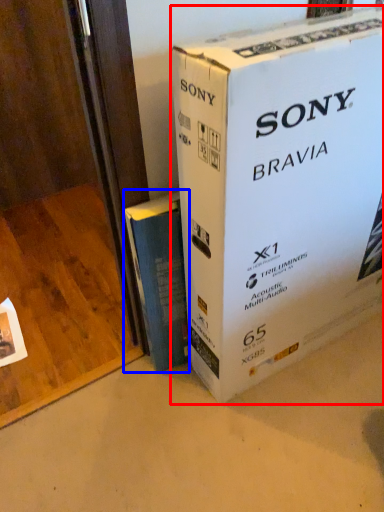
Question: Which object appears farthest to the camera in this image, box (highlighted by a red box) or book (highlighted by a blue box)?

Choices:
 (A) box
 (B) book

Answer: (B)